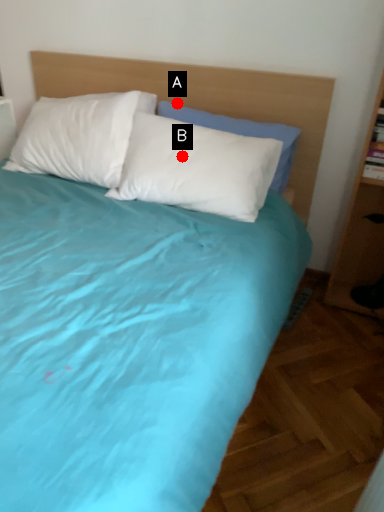
Question: Two points are circled on the image, labeled by A and B beside each circle. Which point appears closest to the camera in this image?

Choices:
 (A) A is closer
 (B) B is closer

Answer: (B)